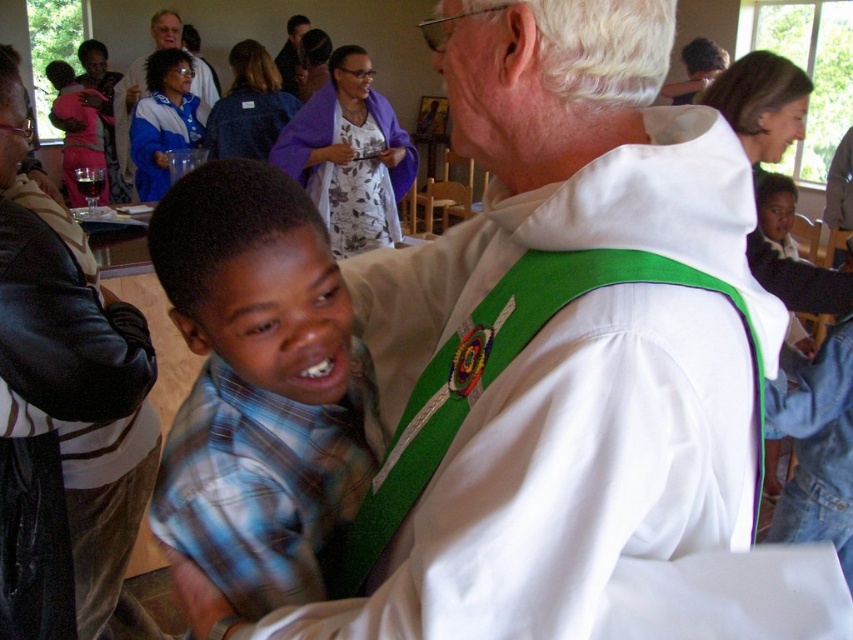
Is white matte vest at center to the right of purple fabric robe at upper center from the viewer's perspective?

Correct, you'll find white matte vest at center to the right of purple fabric robe at upper center.

Who is shorter, white matte vest at center or purple fabric robe at upper center?

Standing shorter between the two is white matte vest at center.

You are a GUI agent. You are given a task and a screenshot of the screen. Output one action in this format:
    pyautogui.click(x=<x>, y=<y>)
    Task: Click on the white matte vest at center
    The width and height of the screenshot is (853, 640).
    Given the screenshot: What is the action you would take?
    pyautogui.click(x=567, y=476)

Can you confirm if blue fabric robe at center is positioned above smooth brown leather jacket at upper center?

Incorrect, blue fabric robe at center is not positioned above smooth brown leather jacket at upper center.

Between blue fabric robe at center and smooth brown leather jacket at upper center, which one is positioned higher?

smooth brown leather jacket at upper center is higher up.

The image size is (853, 640). In order to click on blue fabric robe at center in this screenshot , I will do `click(247, 122)`.

You are a GUI agent. You are given a task and a screenshot of the screen. Output one action in this format:
    pyautogui.click(x=<x>, y=<y>)
    Task: Click on the blue fabric robe at center
    This screenshot has height=640, width=853.
    Given the screenshot: What is the action you would take?
    pyautogui.click(x=247, y=122)

Who is positioned more to the right, blue plaid shirt at center or blue fabric robe at center?

From the viewer's perspective, blue plaid shirt at center appears more on the right side.

Is blue plaid shirt at center positioned in front of blue fabric robe at center?

Yes.

The image size is (853, 640). Describe the element at coordinates (258, 385) in the screenshot. I see `blue plaid shirt at center` at that location.

Locate an element on the screen. Image resolution: width=853 pixels, height=640 pixels. blue plaid shirt at center is located at coordinates (258, 385).